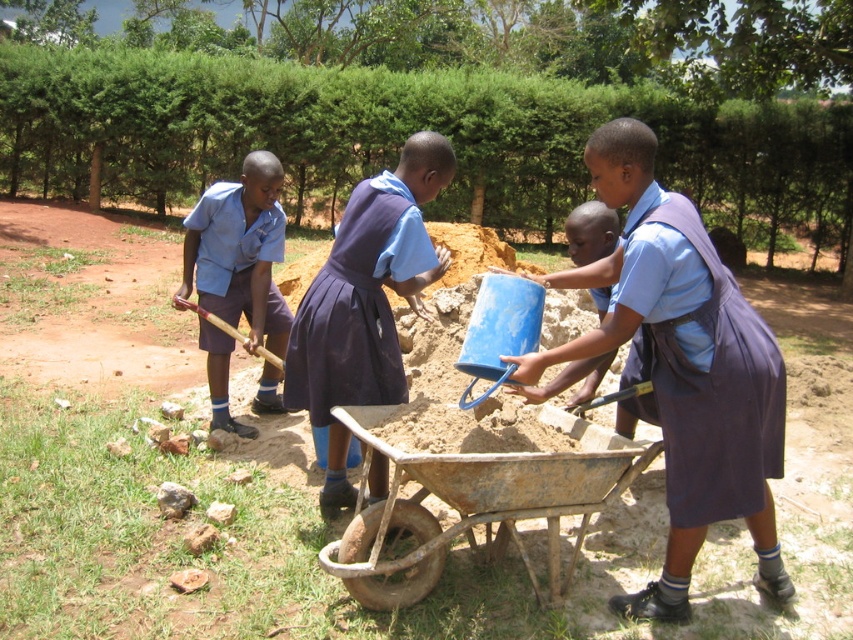
You are a teacher supervising the children in the construction activity. You need to move a heavy object from the rusty metal cart at center to the purple fabric dress at center. Given the distance between them, do you think you can carry it directly without needing to stop or adjust your path?

The distance between the rusty metal cart at center and the purple fabric dress at center is 25.85 inches, so you can carry the heavy object directly without needing to stop or adjust your path since the distance is manageable.

You are a teacher supervising the children in the construction activity. You need to retrieve the purple fabric dress at center to give to the child who is observing. Can you reach it without moving the rusty metal cart at center?

The rusty metal cart at center is closer to the viewer than the purple fabric dress at center, so you would have to move the cart to access the dress.

You are a teacher supervising the children. You need to place the blue matte bucket at center and the matte blue uniform at left into a storage bin. The bin can only fit one item. Which item should you choose based on their widths?

The blue matte bucket at center might be wider than the matte blue uniform at left, so the uniform is narrower and can fit into the bin.